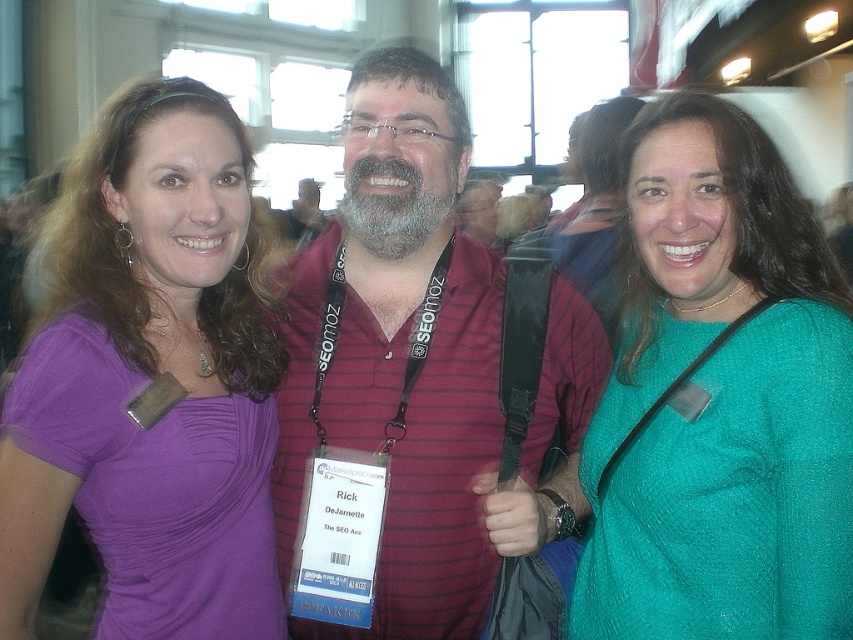
Between point (241, 513) and point (689, 401), which one is positioned behind?

The point (241, 513) is behind.

Which of these two, matte purple shirt at left or teal textured sweater at center, stands shorter?

With less height is teal textured sweater at center.

Which is behind, point (93, 211) or point (780, 403)?

The point (93, 211) is more distant.

This screenshot has height=640, width=853. I want to click on matte purple shirt at left, so click(x=149, y=380).

Can you confirm if maroon striped shirt at center is positioned below graybeard at center?

Yes.

The height and width of the screenshot is (640, 853). Describe the element at coordinates (399, 355) in the screenshot. I see `maroon striped shirt at center` at that location.

Identify the location of maroon striped shirt at center. (399, 355).

Does teal textured sweater at center appear on the left side of graybeard at center?

No, teal textured sweater at center is not to the left of graybeard at center.

The width and height of the screenshot is (853, 640). What do you see at coordinates (720, 397) in the screenshot?
I see `teal textured sweater at center` at bounding box center [720, 397].

I want to click on teal textured sweater at center, so click(720, 397).